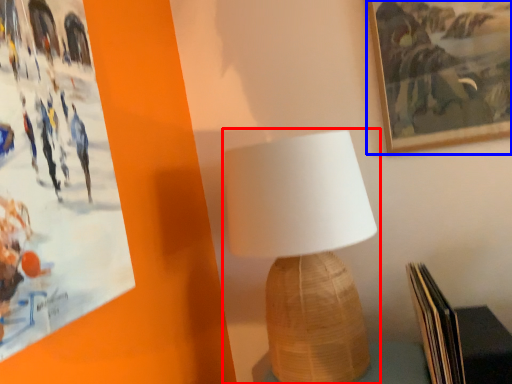
Question: Which of the following is the closest to the observer, lamp (highlighted by a red box) or picture frame (highlighted by a blue box)?

Choices:
 (A) lamp
 (B) picture frame

Answer: (A)